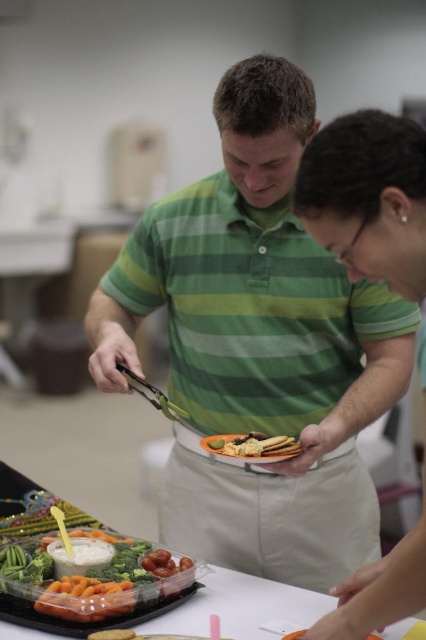
Which is above, matte black plate at center or golden crispy fries at center?

matte black plate at center is higher up.

Is matte black plate at center taller than golden crispy fries at center?

Correct, matte black plate at center is much taller as golden crispy fries at center.

Is point (313, 196) positioned behind point (279, 452)?

No, (313, 196) is closer to viewer.

This screenshot has width=426, height=640. Find the location of `matte black plate at center`. matte black plate at center is located at coordinates (368, 196).

Does green striped polo shirt at center have a lesser width compared to fresh green broccoli at lower left?

No, green striped polo shirt at center is not thinner than fresh green broccoli at lower left.

Is point (189, 356) less distant than point (138, 604)?

That is False.

Locate an element on the screen. The width and height of the screenshot is (426, 640). green striped polo shirt at center is located at coordinates (259, 346).

Is point (293, 196) closer to camera compared to point (28, 557)?

Yes, it is.

Is point (379, 147) positioned after point (11, 620)?

No, it is not.

This screenshot has width=426, height=640. In order to click on matte black plate at center in this screenshot , I will do `click(368, 196)`.